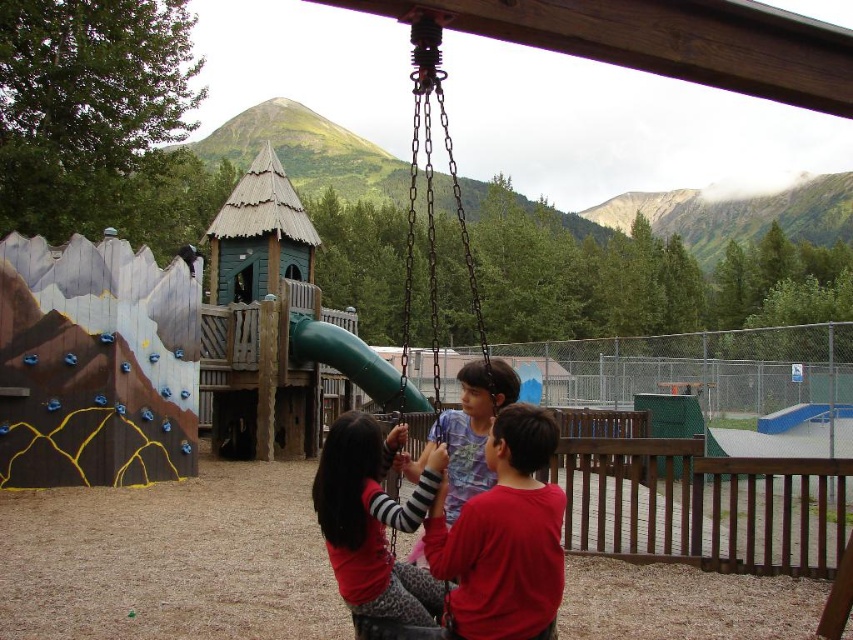
Question: Is matte red shirt at center to the right of light blue striped shirt at center from the viewer's perspective?

Choices:
 (A) no
 (B) yes

Answer: (A)

Question: Which object is positioned closest to the light blue striped shirt at center?

Choices:
 (A) red cotton shirt at center
 (B) green rubber slide at center

Answer: (A)

Question: Which of the following is the farthest from the observer?

Choices:
 (A) green rubber slide at center
 (B) matte red shirt at center

Answer: (A)

Question: Where is matte red shirt at center located in relation to green rubber slide at center in the image?

Choices:
 (A) below
 (B) above

Answer: (A)

Question: Which point is closer to the camera?

Choices:
 (A) red cotton shirt at center
 (B) matte red shirt at center
 (C) green rubber slide at center

Answer: (A)

Question: Is the position of red cotton shirt at center less distant than that of light blue striped shirt at center?

Choices:
 (A) yes
 (B) no

Answer: (A)